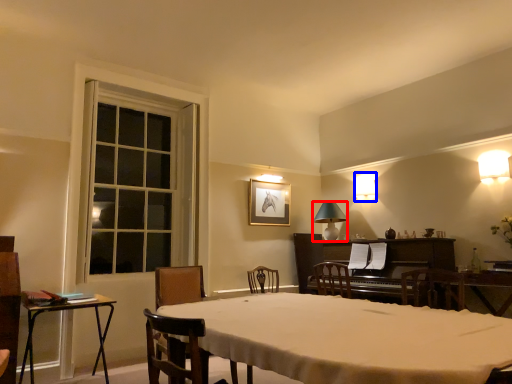
Question: Which object appears closest to the camera in this image, lamp (highlighted by a red box) or lamp (highlighted by a blue box)?

Choices:
 (A) lamp
 (B) lamp

Answer: (A)